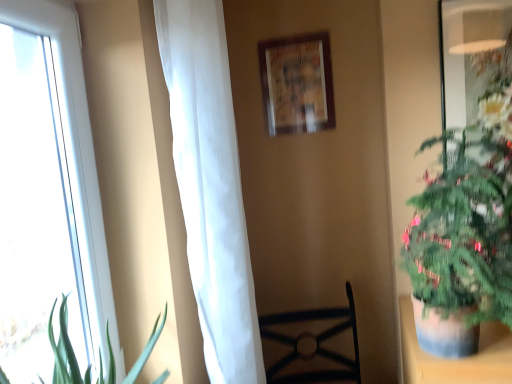
Question: From a real-world perspective, is white sheer curtain at left physically above black metal chair at center?

Choices:
 (A) no
 (B) yes

Answer: (B)

Question: Can you confirm if white sheer curtain at left is positioned to the left of black metal chair at center?

Choices:
 (A) no
 (B) yes

Answer: (B)

Question: Is white sheer curtain at left positioned beyond the bounds of black metal chair at center?

Choices:
 (A) no
 (B) yes

Answer: (B)

Question: Can you confirm if white sheer curtain at left is shorter than black metal chair at center?

Choices:
 (A) no
 (B) yes

Answer: (A)

Question: Is white sheer curtain at left looking in the opposite direction of black metal chair at center?

Choices:
 (A) yes
 (B) no

Answer: (B)

Question: Can you confirm if white sheer curtain at left is wider than black metal chair at center?

Choices:
 (A) no
 (B) yes

Answer: (A)

Question: Does green leafy plant at right have a lesser width compared to white glass window at left?

Choices:
 (A) no
 (B) yes

Answer: (A)

Question: Is green leafy plant at right behind white glass window at left?

Choices:
 (A) yes
 (B) no

Answer: (A)

Question: From a real-world perspective, is green leafy plant at right beneath white glass window at left?

Choices:
 (A) yes
 (B) no

Answer: (A)

Question: From the image's perspective, is green leafy plant at right located beneath white glass window at left?

Choices:
 (A) no
 (B) yes

Answer: (B)

Question: Is green leafy plant at right looking in the opposite direction of white glass window at left?

Choices:
 (A) no
 (B) yes

Answer: (A)

Question: From a real-world perspective, is green leafy plant at right located higher than white glass window at left?

Choices:
 (A) no
 (B) yes

Answer: (A)

Question: Is black metal chair at center located outside green leafy plant at right?

Choices:
 (A) yes
 (B) no

Answer: (A)